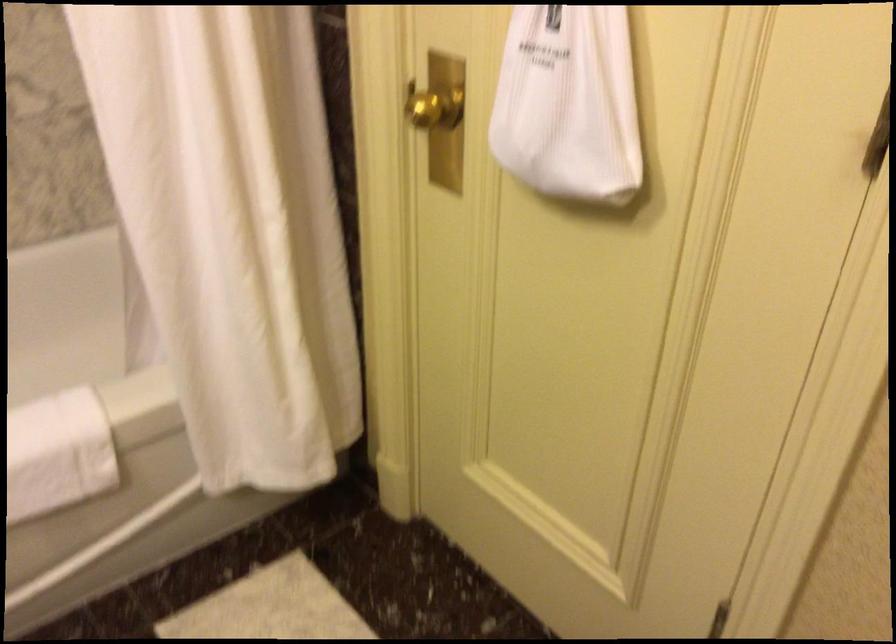
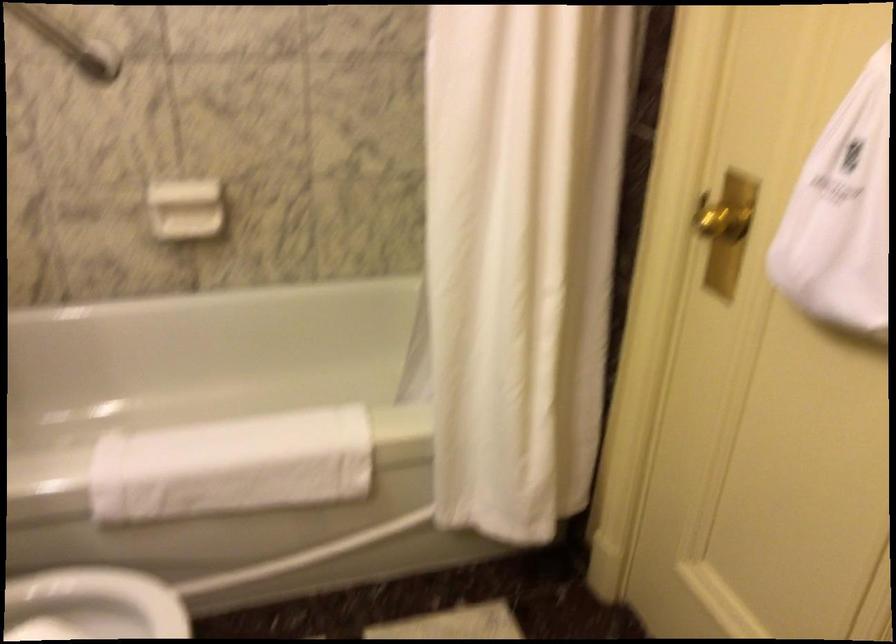
Find the pixel in the second image that matches point (552, 86) in the first image.

(841, 214)